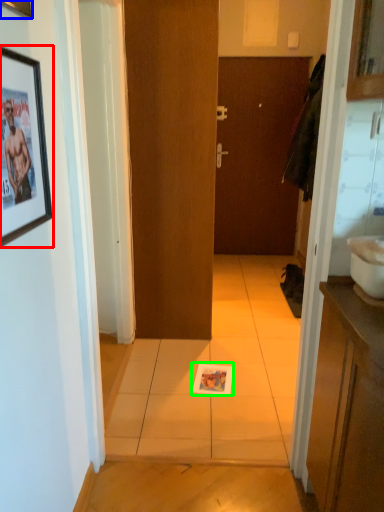
Question: Considering the real-world distances, which object is closest to picture frame (highlighted by a red box)? picture frame (highlighted by a blue box) or magazine (highlighted by a green box).

Choices:
 (A) picture frame
 (B) magazine

Answer: (A)